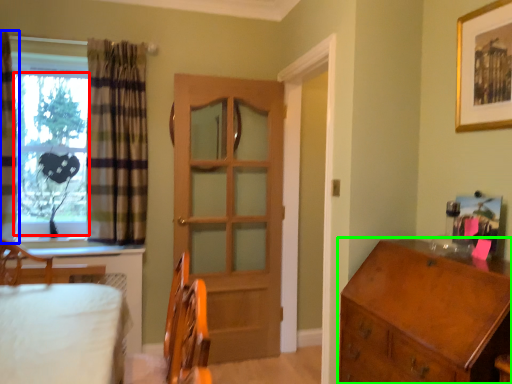
Question: Which is farther away from window screen (highlighted by a red box)? curtain (highlighted by a blue box) or chest of drawers (highlighted by a green box)?

Choices:
 (A) curtain
 (B) chest of drawers

Answer: (B)